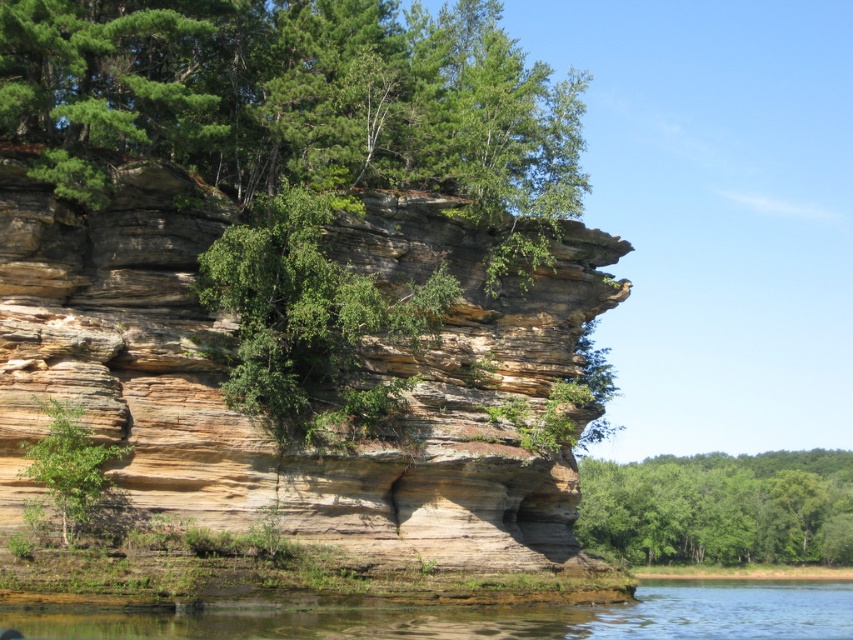
Question: Can you confirm if green leafy tree at lower right is wider than green leafy tree at lower left?

Choices:
 (A) no
 (B) yes

Answer: (B)

Question: Does brown/rocky cliff at center appear on the left side of green leafy tree at lower right?

Choices:
 (A) no
 (B) yes

Answer: (B)

Question: Which of the following is the farthest from the observer?

Choices:
 (A) green leafy tree at lower left
 (B) brown/rocky cliff at center
 (C) green leafy tree at lower right

Answer: (C)

Question: Among these points, which one is farthest from the camera?

Choices:
 (A) (42, 634)
 (B) (607, 545)
 (C) (113, 451)

Answer: (B)

Question: Among these points, which one is nearest to the camera?

Choices:
 (A) (73, 417)
 (B) (448, 624)

Answer: (A)

Question: Is brown/rocky cliff at center to the left of green leafy tree at lower left from the viewer's perspective?

Choices:
 (A) no
 (B) yes

Answer: (A)